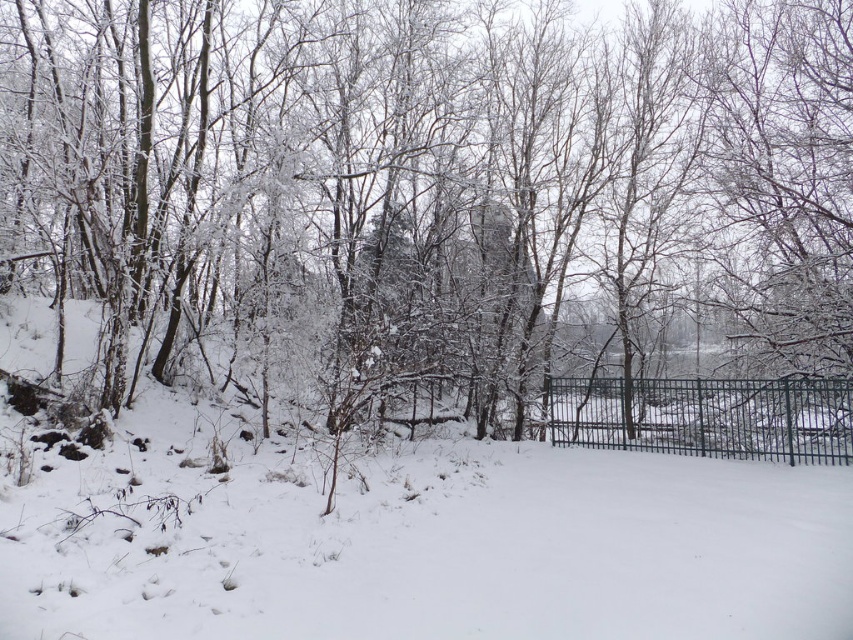
Question: Does white frosty tree at center have a smaller size compared to white fluffy snow at center?

Choices:
 (A) yes
 (B) no

Answer: (B)

Question: Estimate the real-world distances between objects in this image. Which object is farther from the metallic gate at center-right?

Choices:
 (A) white fluffy snow at center
 (B) white frosty tree at center

Answer: (B)

Question: Which object is closer to the camera taking this photo?

Choices:
 (A) white fluffy snow at center
 (B) white frosty tree at center

Answer: (A)

Question: Considering the relative positions of white frosty tree at center and white fluffy snow at center in the image provided, where is white frosty tree at center located with respect to white fluffy snow at center?

Choices:
 (A) left
 (B) right

Answer: (B)

Question: Is white frosty tree at center positioned at the back of metallic gate at center-right?

Choices:
 (A) yes
 (B) no

Answer: (B)

Question: Which object is the farthest from the white fluffy snow at center?

Choices:
 (A) white frosty tree at center
 (B) metallic gate at center-right

Answer: (B)